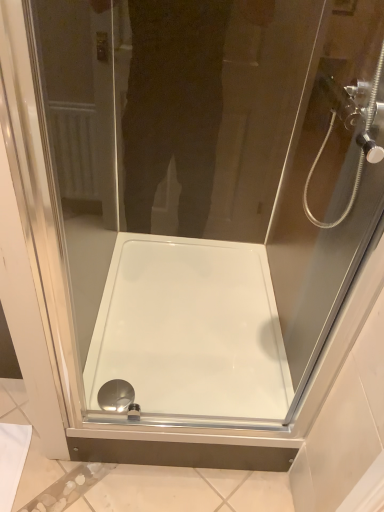
Question: Is transparent glass shower head at upper right behind polished chrome drain at bottom center?

Choices:
 (A) no
 (B) yes

Answer: (A)

Question: Is transparent glass shower head at upper right positioned with its back to polished chrome drain at bottom center?

Choices:
 (A) no
 (B) yes

Answer: (A)

Question: Is the surface of transparent glass shower head at upper right in direct contact with polished chrome drain at bottom center?

Choices:
 (A) yes
 (B) no

Answer: (B)

Question: Is transparent glass shower head at upper right bigger than polished chrome drain at bottom center?

Choices:
 (A) no
 (B) yes

Answer: (B)

Question: Is transparent glass shower head at upper right taller than polished chrome drain at bottom center?

Choices:
 (A) yes
 (B) no

Answer: (A)

Question: Is the depth of transparent glass shower head at upper right less than that of polished chrome drain at bottom center?

Choices:
 (A) yes
 (B) no

Answer: (A)

Question: Considering the relative sizes of white glossy bath at center and polished chrome drain at bottom center in the image provided, is white glossy bath at center bigger than polished chrome drain at bottom center?

Choices:
 (A) yes
 (B) no

Answer: (A)

Question: Does white glossy bath at center turn towards polished chrome drain at bottom center?

Choices:
 (A) no
 (B) yes

Answer: (B)

Question: Considering the relative sizes of white glossy bath at center and polished chrome drain at bottom center in the image provided, is white glossy bath at center shorter than polished chrome drain at bottom center?

Choices:
 (A) no
 (B) yes

Answer: (A)

Question: Does white glossy bath at center appear on the right side of polished chrome drain at bottom center?

Choices:
 (A) no
 (B) yes

Answer: (B)

Question: Is the position of white glossy bath at center less distant than that of polished chrome drain at bottom center?

Choices:
 (A) yes
 (B) no

Answer: (A)

Question: From the image's perspective, is white glossy bath at center above polished chrome drain at bottom center?

Choices:
 (A) yes
 (B) no

Answer: (A)

Question: Is transparent glass shower head at upper right behind white glossy bath at center?

Choices:
 (A) yes
 (B) no

Answer: (B)